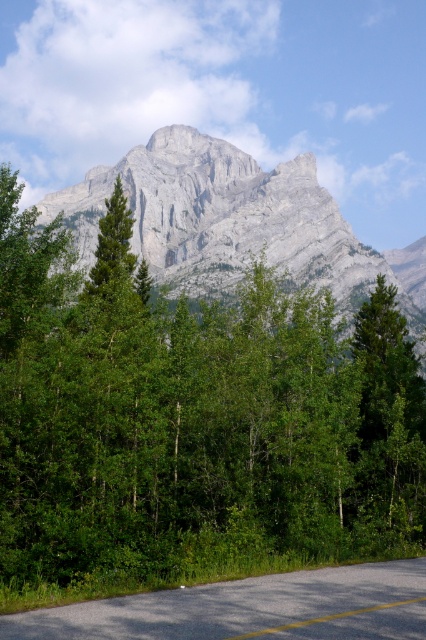
Question: Which point is closer to the camera?

Choices:
 (A) (301, 268)
 (B) (120, 490)

Answer: (B)

Question: Does gray rock mountain at upper center have a greater width compared to gray asphalt road at center?

Choices:
 (A) yes
 (B) no

Answer: (A)

Question: Which point appears closest to the camera in this image?

Choices:
 (A) (199, 401)
 (B) (281, 182)

Answer: (A)

Question: Among these points, which one is nearest to the camera?

Choices:
 (A) 154,636
 (B) 368,307

Answer: (A)

Question: Where is green leafy tree at center located in relation to gray asphalt road at center in the image?

Choices:
 (A) above
 (B) below

Answer: (A)

Question: Can you confirm if gray rock mountain at upper center is positioned to the left of gray asphalt road at center?

Choices:
 (A) yes
 (B) no

Answer: (A)